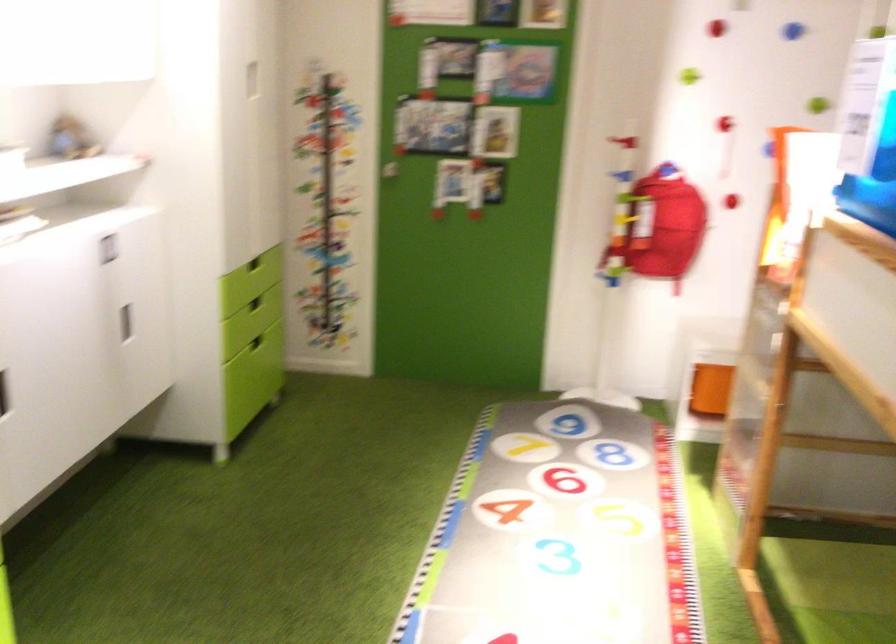
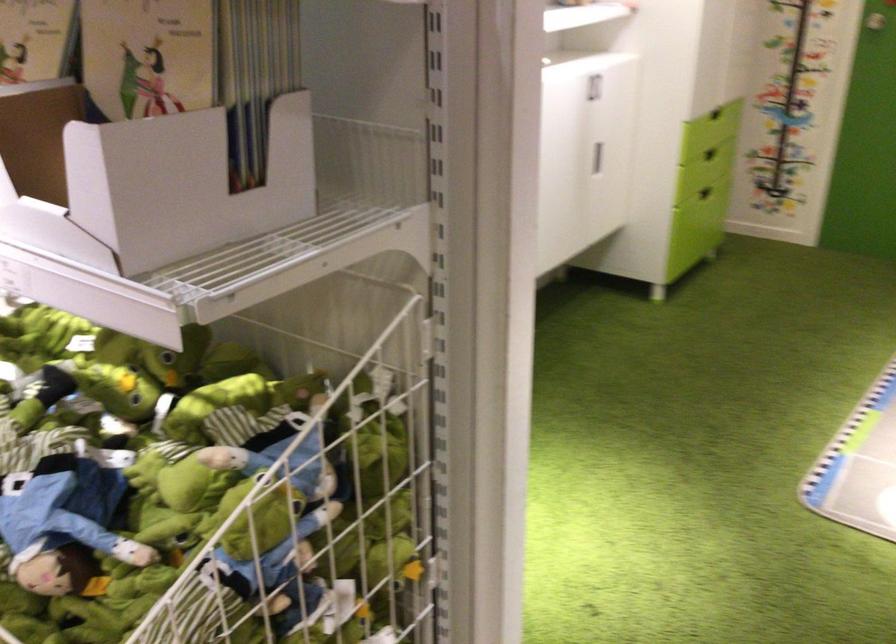
Where in the second image is the point corresponding to point 247,307 from the first image?

(710, 154)